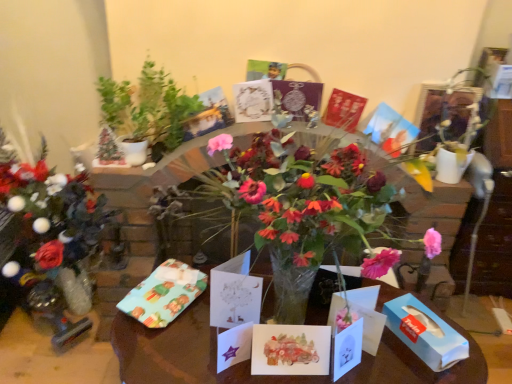
Question: Considering the relative positions of watercolor paper card at center, positioned as the second birthday card in front-to-back order, and white paper card at center, positioned as the fifth birthday card in top-to-bottom order, in the image provided, is watercolor paper card at center, positioned as the second birthday card in front-to-back order, behind white paper card at center, positioned as the fifth birthday card in top-to-bottom order,?

Choices:
 (A) no
 (B) yes

Answer: (B)

Question: From the image's perspective, is watercolor paper card at center, positioned as the second birthday card in front-to-back order, below white paper card at center, positioned as the fifth birthday card in back-to-front order?

Choices:
 (A) yes
 (B) no

Answer: (B)

Question: Is watercolor paper card at center, the 4th birthday card from the top, directly adjacent to white paper card at center, positioned as the 1th birthday card in bottom-to-top order?

Choices:
 (A) no
 (B) yes

Answer: (A)

Question: Would you say watercolor paper card at center, the 4th birthday card from the top, is a long distance from white paper card at center, positioned as the 1th birthday card in bottom-to-top order?

Choices:
 (A) yes
 (B) no

Answer: (B)

Question: Is watercolor paper card at center, arranged as the 2th birthday card when ordered from the bottom, aimed at white paper card at center, positioned as the fifth birthday card in top-to-bottom order?

Choices:
 (A) no
 (B) yes

Answer: (A)

Question: Can you confirm if watercolor paper card at center, arranged as the 2th birthday card when ordered from the bottom, is smaller than white paper card at center, positioned as the 1th birthday card in bottom-to-top order?

Choices:
 (A) yes
 (B) no

Answer: (B)

Question: Is white paper card at center, positioned as the fifth birthday card in back-to-front order, to the right of matte red card at center, which is the fourth birthday card from bottom to top, from the viewer's perspective?

Choices:
 (A) yes
 (B) no

Answer: (B)

Question: Does white paper card at center, positioned as the fifth birthday card in top-to-bottom order, have a lesser width compared to matte red card at center, the fifth birthday card viewed from the front?

Choices:
 (A) yes
 (B) no

Answer: (A)

Question: Can you confirm if white paper card at center, positioned as the 1th birthday card in bottom-to-top order, is positioned to the left of matte red card at center, which is the fourth birthday card from bottom to top?

Choices:
 (A) no
 (B) yes

Answer: (B)

Question: Could matte red card at center, which is counted as the 1th birthday card, starting from the back, be considered to be inside white paper card at center, positioned as the fifth birthday card in top-to-bottom order?

Choices:
 (A) no
 (B) yes

Answer: (A)

Question: From the image's perspective, is white paper card at center, positioned as the fifth birthday card in back-to-front order, under matte red card at center, the second birthday card when ordered from top to bottom?

Choices:
 (A) yes
 (B) no

Answer: (A)

Question: Is white paper card at center, which is the 1th birthday card in front-to-back order, not within matte red card at center, which is counted as the 1th birthday card, starting from the back?

Choices:
 (A) no
 (B) yes

Answer: (B)

Question: Does matte red card at center, the fifth birthday card viewed from the front, come in front of white paper card at center, which is the 1th birthday card in front-to-back order?

Choices:
 (A) yes
 (B) no

Answer: (B)